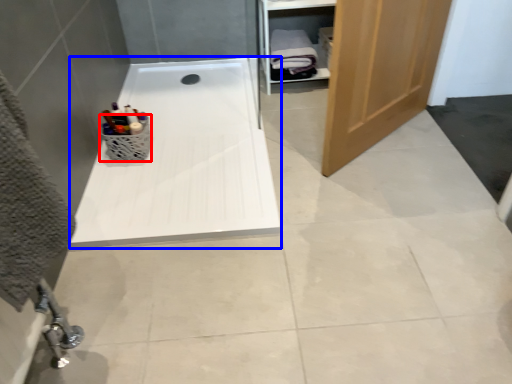
Question: Among these objects, which one is farthest to the camera, basket (highlighted by a red box) or bath (highlighted by a blue box)?

Choices:
 (A) basket
 (B) bath

Answer: (A)